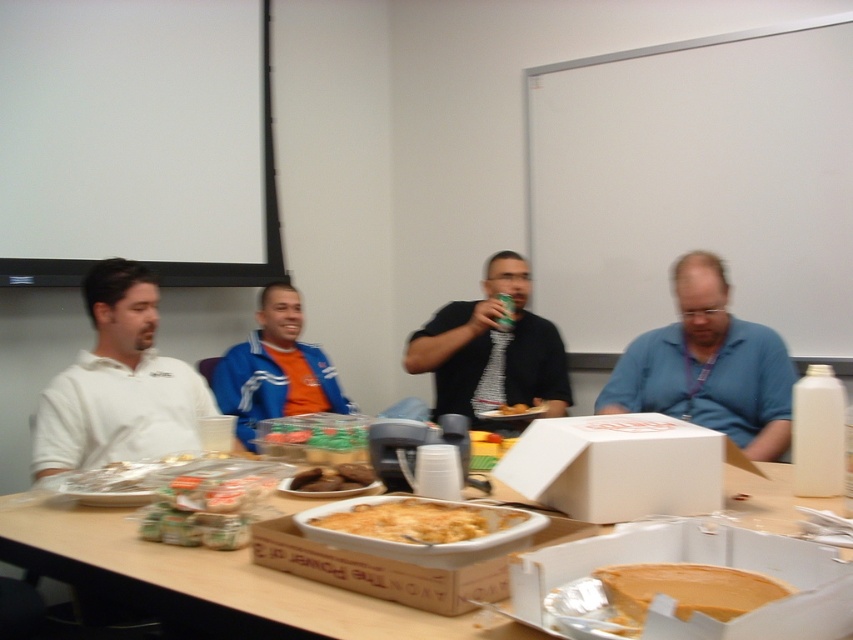
Where is the blue matte shirt at center located in the image?

The blue matte shirt at center is located at the point with coordinates 0.573 on the x axis and 0.831 on the y axis.

You are standing in the conference room and want to find the matte black shirt at center. According to the coordinates provided, where should you look?

You should look at point (492, 349) to find the matte black shirt at center.